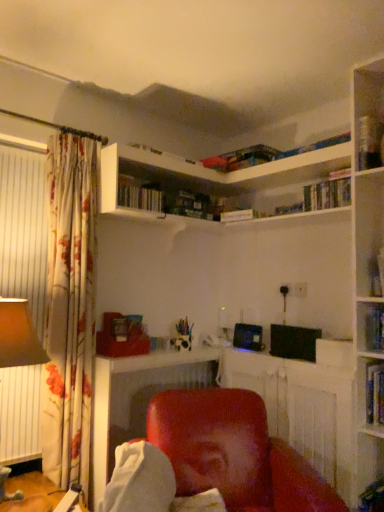
Where is `hardcover book at upper right, the fourth book when ordered from top to bottom`? hardcover book at upper right, the fourth book when ordered from top to bottom is located at coordinates (375, 329).

Describe the element at coordinates (139, 196) in the screenshot. The image size is (384, 512). I see `hardcover book at upper center, which ranks as the second book in bottom-to-top order` at that location.

What do you see at coordinates (369, 143) in the screenshot? I see `hardcover book at upper right, the third book from the left` at bounding box center [369, 143].

Describe the element at coordinates (327, 194) in the screenshot. I see `hardcover book at upper right, positioned as the 3th book in bottom-to-top order` at that location.

Find the location of `matte red chair at lower center`. matte red chair at lower center is located at coordinates (138, 398).

In the scene shown: Is hardcover book at upper right, which ranks as the fourth book in bottom-to-top order, to the left of matte red chair at lower center from the viewer's perspective?

No, hardcover book at upper right, which ranks as the fourth book in bottom-to-top order, is not to the left of matte red chair at lower center.

Based on their sizes in the image, would you say hardcover book at upper right, acting as the first book starting from the top, is bigger or smaller than matte red chair at lower center?

In the image, hardcover book at upper right, acting as the first book starting from the top, appears to be smaller than matte red chair at lower center.

Is hardcover book at upper right, the third book from the left, facing towards matte red chair at lower center?

No, hardcover book at upper right, the third book from the left, does not turn towards matte red chair at lower center.

Is hardcover book at upper right, the 4th book in the left-to-right sequence, facing away from hardcover book at upper right, acting as the first book starting from the top?

hardcover book at upper right, the 4th book in the left-to-right sequence, is not turned away from hardcover book at upper right, acting as the first book starting from the top.

Who is bigger, hardcover book at upper right, the 1th book from the right, or hardcover book at upper right, acting as the first book starting from the top?

hardcover book at upper right, acting as the first book starting from the top.

Looking at this image, considering the relative positions of hardcover book at upper right, which is the 1th book in bottom-to-top order, and hardcover book at upper right, which ranks as the fourth book in bottom-to-top order, in the image provided, is hardcover book at upper right, which is the 1th book in bottom-to-top order, to the right of hardcover book at upper right, which ranks as the fourth book in bottom-to-top order, from the viewer's perspective?

Yes.

Which of these two, hardcover book at upper right, which is the 1th book in bottom-to-top order, or hardcover book at upper right, which ranks as the fourth book in bottom-to-top order, stands shorter?

hardcover book at upper right, which is the 1th book in bottom-to-top order.

From the image's perspective, count 2nd books downward from the hardcover book at upper right, the third book from the left, and point to it. Please provide its 2D coordinates.

[(139, 196)]

Can you tell me how much hardcover book at upper right, acting as the first book starting from the top, and hardcover book at upper center, the 4th book viewed from the right, differ in facing direction?

The angular difference between hardcover book at upper right, acting as the first book starting from the top, and hardcover book at upper center, the 4th book viewed from the right, is 90.5 degrees.

From a real-world perspective, who is located higher, hardcover book at upper right, which ranks as the fourth book in bottom-to-top order, or hardcover book at upper center, the third book positioned from the top?

hardcover book at upper right, which ranks as the fourth book in bottom-to-top order, from a real-world perspective.

From a real-world perspective, is hardcover book at upper right, which ranks as the 3th book in right-to-left order, above or below hardcover book at upper right, the fourth book when ordered from top to bottom?

hardcover book at upper right, which ranks as the 3th book in right-to-left order, is situated higher than hardcover book at upper right, the fourth book when ordered from top to bottom, in the real world.

Can you tell me how much hardcover book at upper right, the second book positioned from the left, and hardcover book at upper right, which is the 1th book in bottom-to-top order, differ in facing direction?

The angular difference between hardcover book at upper right, the second book positioned from the left, and hardcover book at upper right, which is the 1th book in bottom-to-top order, is 0.907 degrees.

In terms of height, does hardcover book at upper right, which ranks as the 3th book in right-to-left order, look taller or shorter compared to hardcover book at upper right, the 1th book from the right?

Considering their sizes, hardcover book at upper right, which ranks as the 3th book in right-to-left order, has less height than hardcover book at upper right, the 1th book from the right.

Is hardcover book at upper right, the 4th book in the left-to-right sequence, at the back of hardcover book at upper right, the second book positioned from the left?

No, hardcover book at upper right, the second book positioned from the left,'s orientation is not away from hardcover book at upper right, the 4th book in the left-to-right sequence.

Is point (150, 203) farther from viewer compared to point (122, 364)?

Yes, point (150, 203) is behind point (122, 364).

Considering the sizes of hardcover book at upper center, the 1th book when ordered from left to right, and matte red chair at lower center in the image, is hardcover book at upper center, the 1th book when ordered from left to right, taller or shorter than matte red chair at lower center?

Clearly, hardcover book at upper center, the 1th book when ordered from left to right, is shorter compared to matte red chair at lower center.

From the image's perspective, which object appears higher, hardcover book at upper center, the 4th book viewed from the right, or matte red chair at lower center?

hardcover book at upper center, the 4th book viewed from the right, appears higher in the image.

Is hardcover book at upper right, the third book from the left, taller or shorter than matte red chair at center?

hardcover book at upper right, the third book from the left, is shorter than matte red chair at center.

From a real-world perspective, is hardcover book at upper right, acting as the first book starting from the top, over matte red chair at center?

Yes, from a real-world perspective, hardcover book at upper right, acting as the first book starting from the top, is over matte red chair at center

Is hardcover book at upper right, acting as the first book starting from the top, oriented towards matte red chair at center?

No.

Which point is more forward, (7, 349) or (131, 202)?

Point (7, 349)

How far apart are matte brown lampshade at left and hardcover book at upper center, the 1th book when ordered from left to right?

A distance of 33.12 inches exists between matte brown lampshade at left and hardcover book at upper center, the 1th book when ordered from left to right.

Is matte brown lampshade at left looking in the opposite direction of hardcover book at upper center, the 1th book when ordered from left to right?

matte brown lampshade at left does not have its back to hardcover book at upper center, the 1th book when ordered from left to right.

Consider the image. From a real-world perspective, is matte brown lampshade at left positioned above or below hardcover book at upper center, the 4th book viewed from the right?

From a real-world perspective, matte brown lampshade at left is physically below hardcover book at upper center, the 4th book viewed from the right.

I want to click on table on the left side of hardcover book at upper right, the third book from the left, so click(x=138, y=398).

From the image's perspective, which book is the 3rd one above the hardcover book at upper right, which is the 1th book in bottom-to-top order? Please provide its 2D coordinates.

[(369, 143)]

Based on their spatial positions, is hardcover book at upper right, the fourth book when ordered from top to bottom, or matte red chair at lower center further from matte brown lampshade at left?

hardcover book at upper right, the fourth book when ordered from top to bottom, is further to matte brown lampshade at left.

When comparing their distances from hardcover book at upper right, the second book when ordered from top to bottom, does hardcover book at upper right, the 1th book from the right, or matte red chair at center seem closer?

Among the two, hardcover book at upper right, the 1th book from the right, is located nearer to hardcover book at upper right, the second book when ordered from top to bottom.

Considering their positions, is matte red chair at center positioned further to hardcover book at upper right, the second book positioned from the left, than hardcover book at upper right, which ranks as the fourth book in bottom-to-top order?

matte red chair at center lies further to hardcover book at upper right, the second book positioned from the left, than the other object.

Which object lies nearer to the anchor point hardcover book at upper right, which ranks as the fourth book in bottom-to-top order, matte red chair at lower center or hardcover book at upper center, the third book positioned from the top?

Among the two, hardcover book at upper center, the third book positioned from the top, is located nearer to hardcover book at upper right, which ranks as the fourth book in bottom-to-top order.

Estimate the real-world distances between objects in this image. Which object is closer to matte brown lampshade at left, matte red chair at lower center or hardcover book at upper right, acting as the first book starting from the top?

Among the two, matte red chair at lower center is located nearer to matte brown lampshade at left.

From the image, which object appears to be farther from hardcover book at upper center, which ranks as the second book in bottom-to-top order, matte red chair at center or hardcover book at upper right, the 4th book in the left-to-right sequence?

hardcover book at upper right, the 4th book in the left-to-right sequence.

Consider the image. Based on their spatial positions, is hardcover book at upper right, which ranks as the fourth book in bottom-to-top order, or hardcover book at upper right, the 1th book from the right, closer to hardcover book at upper right, positioned as the 3th book in bottom-to-top order?

hardcover book at upper right, which ranks as the fourth book in bottom-to-top order, is closer to hardcover book at upper right, positioned as the 3th book in bottom-to-top order.

From the image, which object appears to be farther from matte red chair at lower center, hardcover book at upper right, which ranks as the fourth book in bottom-to-top order, or hardcover book at upper right, the fourth book when ordered from top to bottom?

hardcover book at upper right, which ranks as the fourth book in bottom-to-top order, lies further to matte red chair at lower center than the other object.

Image resolution: width=384 pixels, height=512 pixels. I want to click on chair situated between hardcover book at upper center, which ranks as the second book in bottom-to-top order, and hardcover book at upper right, which is the 1th book in bottom-to-top order, from left to right, so click(x=234, y=452).

At what (x,y) coordinates should I click in order to perform the action: click on book located between hardcover book at upper center, which ranks as the second book in bottom-to-top order, and hardcover book at upper right, acting as the first book starting from the top, in the left-right direction. Please return your answer as a coordinate pair (x, y). Looking at the image, I should click on (327, 194).

This screenshot has width=384, height=512. I want to click on table lamp between hardcover book at upper center, which ranks as the second book in bottom-to-top order, and matte red chair at lower center vertically, so click(19, 336).

Image resolution: width=384 pixels, height=512 pixels. Find the location of `table between matte brown lampshade at left and hardcover book at upper right, which is the 1th book in bottom-to-top order`. table between matte brown lampshade at left and hardcover book at upper right, which is the 1th book in bottom-to-top order is located at coordinates (138, 398).